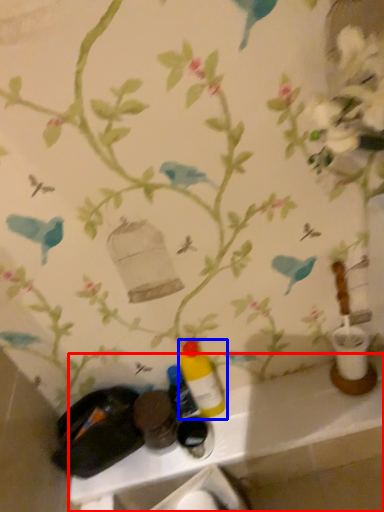
Question: Which point is further to the camera, counter (highlighted by a red box) or bottle (highlighted by a blue box)?

Choices:
 (A) counter
 (B) bottle

Answer: (A)